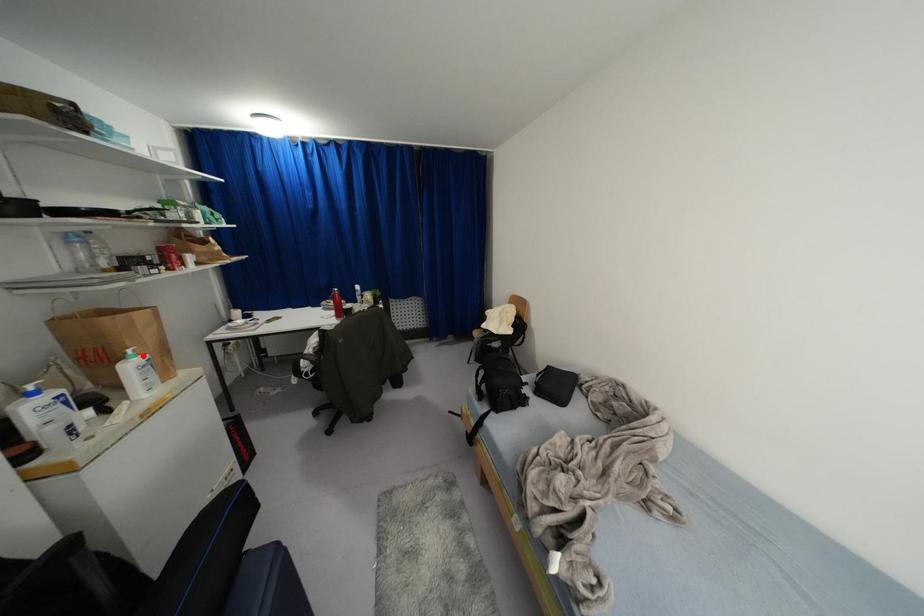
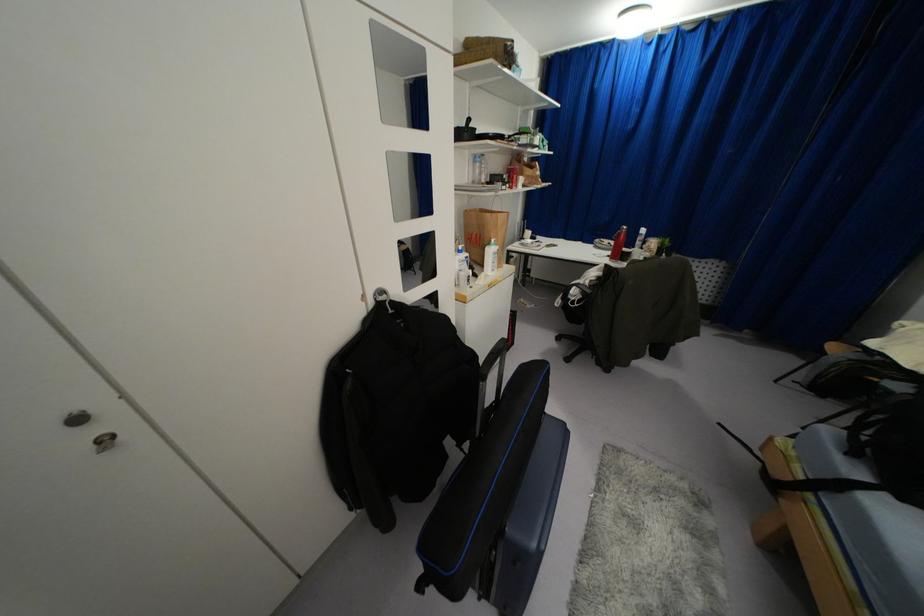
In the second image, find the point that corresponds to the highlighted location in the first image.

(495, 246)